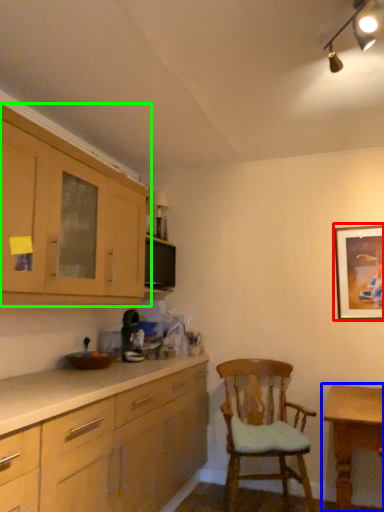
Question: Which object is positioned closest to picture frame (highlighted by a red box)? Select from table (highlighted by a blue box) and cabinetry (highlighted by a green box).

Choices:
 (A) table
 (B) cabinetry

Answer: (A)